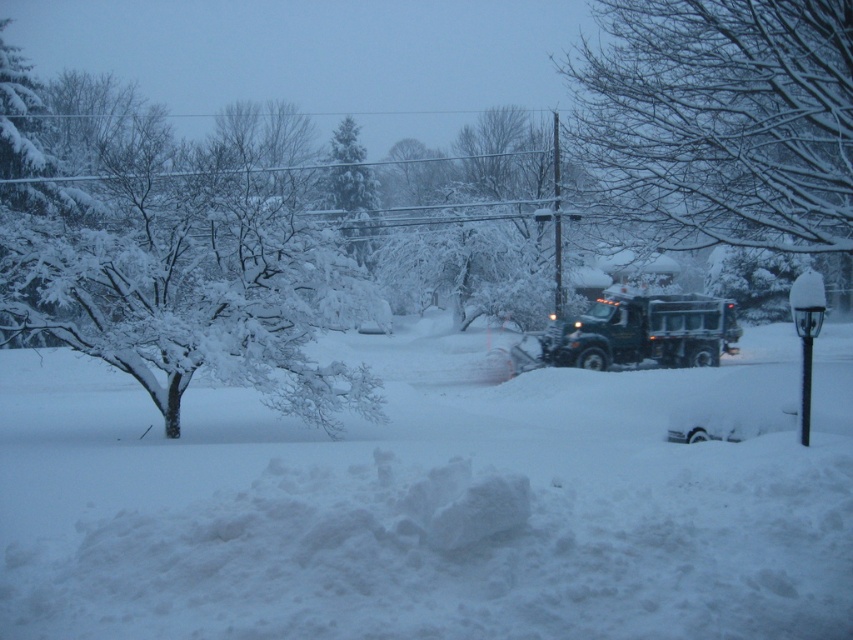
Question: Does snow-covered branches at upper center appear under green matte truck at center?

Choices:
 (A) no
 (B) yes

Answer: (A)

Question: Estimate the real-world distances between objects in this image. Which object is closer to the snow-covered branches at upper center?

Choices:
 (A) white fluffy snow at center
 (B) snow-covered evergreen at center
 (C) green matte truck at center
 (D) white snow-covered tree at left

Answer: (A)

Question: Is white fluffy snow at center further to the viewer compared to snow-covered branches at upper center?

Choices:
 (A) yes
 (B) no

Answer: (B)

Question: Can you confirm if snow-covered branches at upper center is wider than green matte truck at center?

Choices:
 (A) no
 (B) yes

Answer: (B)

Question: Among these points, which one is nearest to the camera?

Choices:
 (A) coord(257,141)
 (B) coord(640,342)
 (C) coord(358,211)
 (D) coord(659,484)

Answer: (D)

Question: Which of the following is the farthest from the observer?

Choices:
 (A) green matte truck at center
 (B) white snow-covered tree at left

Answer: (A)